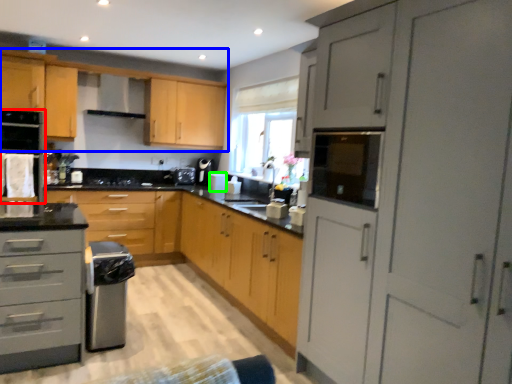
Question: Estimate the real-world distances between objects in this image. Which object is farther from home appliance (highlighted by a red box), cabinetry (highlighted by a blue box) or appliance (highlighted by a green box)?

Choices:
 (A) cabinetry
 (B) appliance

Answer: (B)